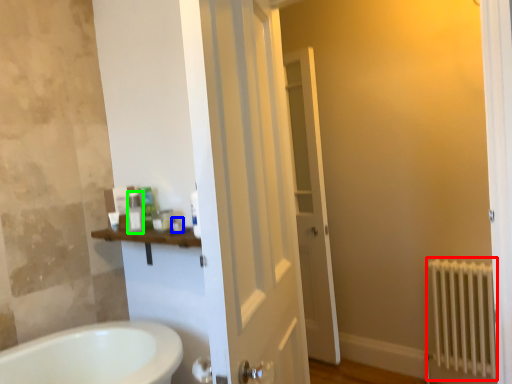
Question: Considering the real-world distances, which object is closest to radiator (highlighted by a red box)? toiletry (highlighted by a blue box) or toiletry (highlighted by a green box).

Choices:
 (A) toiletry
 (B) toiletry

Answer: (A)